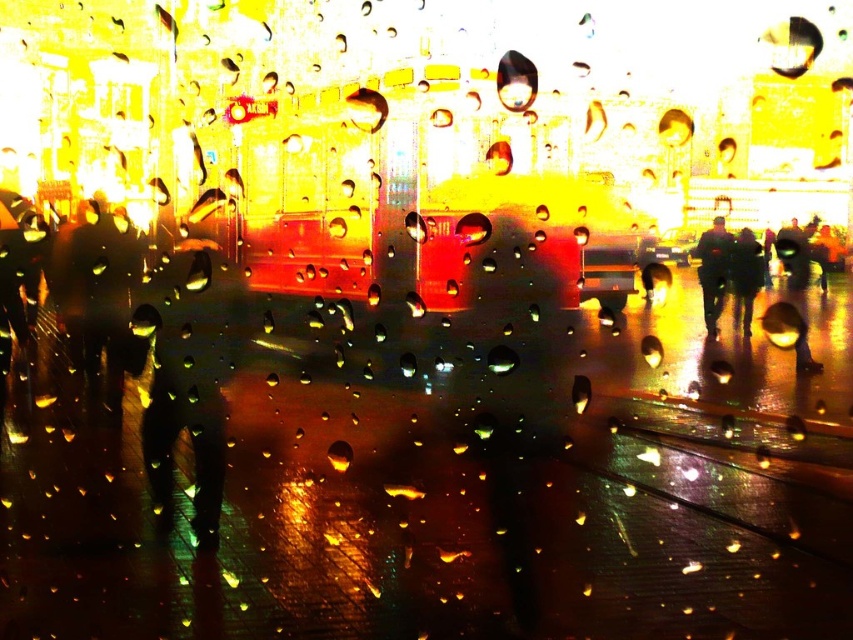
Is dark blue jacket at center to the right of dark gray fabric jacket at center from the viewer's perspective?

In fact, dark blue jacket at center is to the left of dark gray fabric jacket at center.

Does point (732, 244) come in front of point (747, 228)?

No, it is behind (747, 228).

Find the location of a particular element. The width and height of the screenshot is (853, 640). dark blue jacket at center is located at coordinates tap(712, 269).